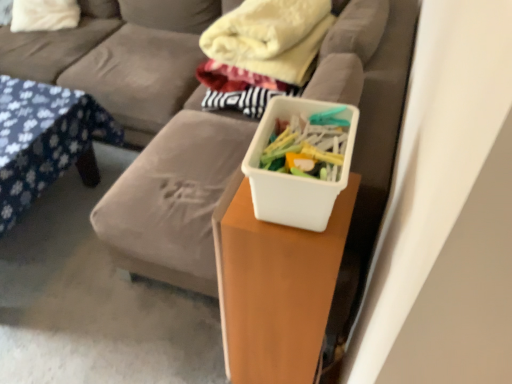
What is the approximate width of white plastic container at center?

It is 7.76 inches.

What is the approximate height of soft gray couch at center?

The height of soft gray couch at center is 32.89 inches.

Identify the location of soft yellow blanket at upper center. (265, 43).

Describe the element at coordinates (275, 287) in the screenshot. I see `white matte plastic container at center` at that location.

At what (x,y) coordinates should I click in order to perform the action: click on white matte plastic container at center. Please return your answer as a coordinate pair (x, y). This screenshot has width=512, height=384. Looking at the image, I should click on (275, 287).

The image size is (512, 384). What are the coordinates of `white soft pillow at upper left` in the screenshot? It's located at (44, 15).

What is the approximate width of blue floral fabric at left?

blue floral fabric at left is 35.15 inches in width.

The width and height of the screenshot is (512, 384). Find the location of `white plastic container at center`. white plastic container at center is located at coordinates (294, 176).

Who is bigger, blue floral fabric at left or white matte plastic container at center?

blue floral fabric at left.

Is blue floral fabric at left taller or shorter than white matte plastic container at center?

Considering their sizes, blue floral fabric at left has less height than white matte plastic container at center.

Is blue floral fabric at left in front of or behind white matte plastic container at center in the image?

blue floral fabric at left is behind white matte plastic container at center.

Considering the relative sizes of blue floral fabric at left and white matte plastic container at center in the image provided, is blue floral fabric at left wider than white matte plastic container at center?

Yes.

Can you confirm if gray fabric couch at center is thinner than soft yellow blanket at upper center?

No, gray fabric couch at center is not thinner than soft yellow blanket at upper center.

At what (x,y) coordinates should I click in order to perform the action: click on blanket behind the gray fabric couch at center. Please return your answer as a coordinate pair (x, y). The width and height of the screenshot is (512, 384). Looking at the image, I should click on (265, 43).

From the image's perspective, would you say gray fabric couch at center is shown under soft yellow blanket at upper center?

Correct, gray fabric couch at center appears lower than soft yellow blanket at upper center in the image.

Is gray fabric couch at center outside of soft yellow blanket at upper center?

Yes, gray fabric couch at center is not within soft yellow blanket at upper center.

Could you tell me if gray fabric couch at center is facing white soft pillow at upper left?

No.

The height and width of the screenshot is (384, 512). In order to click on pillow above the gray fabric couch at center (from the image's perspective) in this screenshot , I will do `click(44, 15)`.

Considering the sizes of objects gray fabric couch at center and white soft pillow at upper left in the image provided, who is thinner, gray fabric couch at center or white soft pillow at upper left?

With smaller width is white soft pillow at upper left.

Considering the sizes of objects gray fabric couch at center and white soft pillow at upper left in the image provided, who is smaller, gray fabric couch at center or white soft pillow at upper left?

white soft pillow at upper left.

Between gray fabric couch at center and blue floral fabric at left, which one has smaller width?

blue floral fabric at left.

Between point (315, 82) and point (52, 129), which one is positioned in front?

The point (315, 82) is more forward.

Could you tell me if gray fabric couch at center is turned towards blue floral fabric at left?

Yes, gray fabric couch at center is facing blue floral fabric at left.

From a real-world perspective, is gray fabric couch at center over blue floral fabric at left?

Yes.

Does white matte plastic container at center touch white soft pillow at upper left?

No, white matte plastic container at center is not in contact with white soft pillow at upper left.

Is white matte plastic container at center oriented away from white soft pillow at upper left?

white matte plastic container at center does not have its back to white soft pillow at upper left.

Does white matte plastic container at center appear on the right side of white soft pillow at upper left?

Yes, white matte plastic container at center is to the right of white soft pillow at upper left.

Identify the location of pillow located behind the white matte plastic container at center. (44, 15).

Which is less distant, (45, 22) or (275, 98)?

Point (45, 22) appears to be farther away from the viewer than point (275, 98).

From the image's perspective, does white soft pillow at upper left appear lower than white plastic container at center?

Incorrect, from the image's perspective, white soft pillow at upper left is higher than white plastic container at center.

Is white soft pillow at upper left aimed at white plastic container at center?

No, white soft pillow at upper left is not facing towards white plastic container at center.

Considering the sizes of white soft pillow at upper left and white plastic container at center in the image, is white soft pillow at upper left wider or thinner than white plastic container at center?

In the image, white soft pillow at upper left appears to be wider than white plastic container at center.

Is white soft pillow at upper left positioned with its back to white matte plastic container at center?

No.

From the image's perspective, is white soft pillow at upper left under white matte plastic container at center?

No, from the image's perspective, white soft pillow at upper left is not beneath white matte plastic container at center.

Looking at this image, does white soft pillow at upper left have a larger size compared to white matte plastic container at center?

Incorrect, white soft pillow at upper left is not larger than white matte plastic container at center.

This screenshot has width=512, height=384. I want to click on furniture below the white matte plastic container at center (from a real-world perspective), so point(46,140).

Where is `blanket on the right of gray fabric couch at center`? The height and width of the screenshot is (384, 512). blanket on the right of gray fabric couch at center is located at coordinates (265, 43).

Based on their spatial positions, is soft yellow blanket at upper center or white plastic container at center closer to blue floral fabric at left?

soft yellow blanket at upper center.

Estimate the real-world distances between objects in this image. Which object is further from gray fabric couch at center, blue floral fabric at left or soft yellow blanket at upper center?

soft yellow blanket at upper center is further to gray fabric couch at center.

Estimate the real-world distances between objects in this image. Which object is further from soft gray couch at center, blue floral fabric at left or white matte plastic container at center?

white matte plastic container at center is further to soft gray couch at center.

When comparing their distances from white plastic container at center, does gray fabric couch at center or white soft pillow at upper left seem closer?

gray fabric couch at center is closer to white plastic container at center.

From the image, which object appears to be farther from soft gray couch at center, white soft pillow at upper left or gray fabric couch at center?

Based on the image, white soft pillow at upper left appears to be further to soft gray couch at center.

Looking at the image, which one is located closer to soft gray couch at center, gray fabric couch at center or white soft pillow at upper left?

gray fabric couch at center lies closer to soft gray couch at center than the other object.

Looking at the image, which one is located further to blue floral fabric at left, white plastic container at center or white matte plastic container at center?

Among the two, white plastic container at center is located further to blue floral fabric at left.

When comparing their distances from gray fabric couch at center, does white matte plastic container at center or white plastic container at center seem closer?

The object closer to gray fabric couch at center is white matte plastic container at center.

Where is `studio couch located between white plastic container at center and white soft pillow at upper left in the depth direction`? studio couch located between white plastic container at center and white soft pillow at upper left in the depth direction is located at coordinates (148, 126).

Identify the location of table situated between gray fabric couch at center and white plastic container at center from left to right. (275, 287).

You are a GUI agent. You are given a task and a screenshot of the screen. Output one action in this format:
    pyautogui.click(x=<x>, y=<y>)
    Task: Click on the studio couch located between blue floral fabric at left and white matte plastic container at center in the left-right direction
    The height and width of the screenshot is (384, 512).
    Given the screenshot: What is the action you would take?
    pyautogui.click(x=148, y=126)

Locate an element on the screen. This screenshot has width=512, height=384. table located between white plastic container at center and white soft pillow at upper left in the depth direction is located at coordinates pos(275,287).